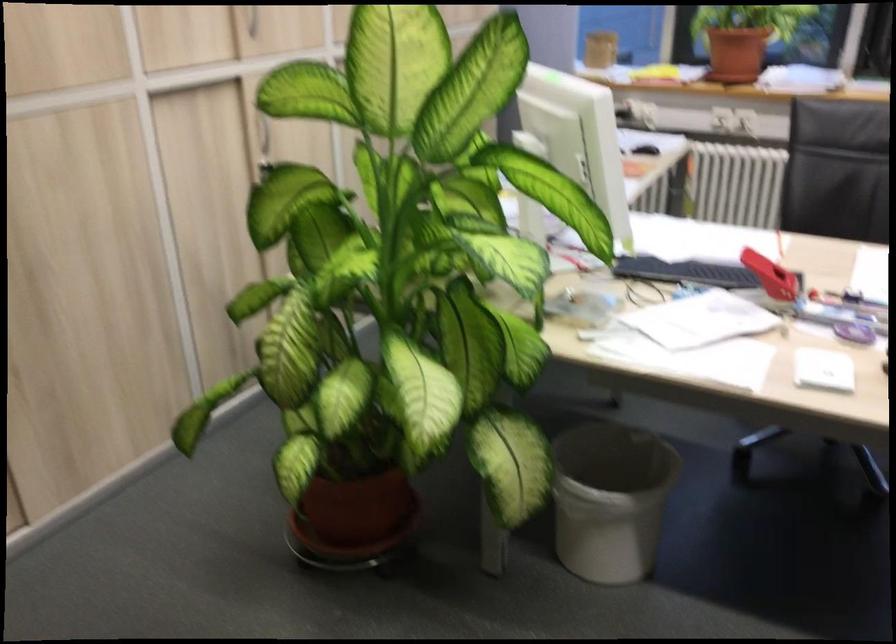
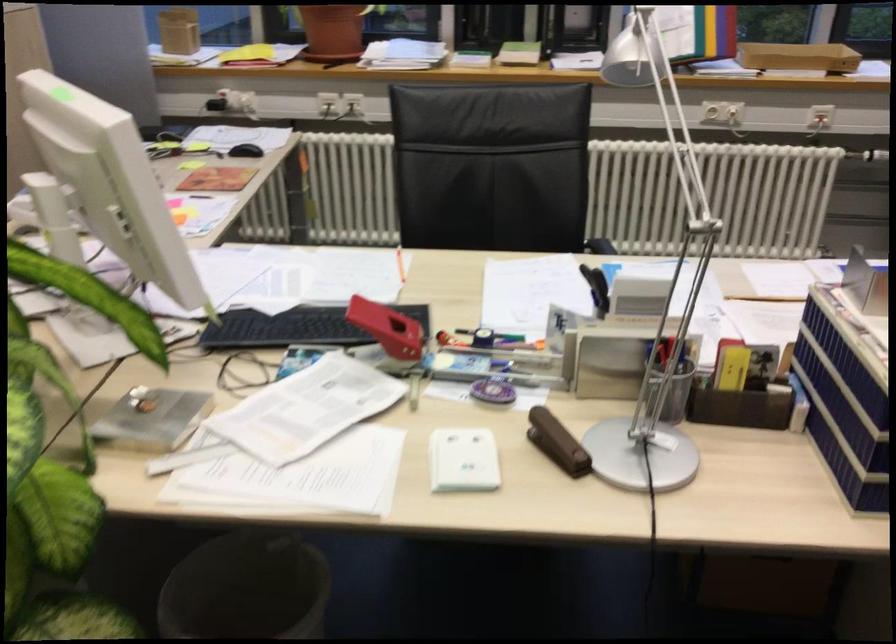
Which direction would the cameraman need to move to produce the second image?

The cameraman walked toward right, forward.